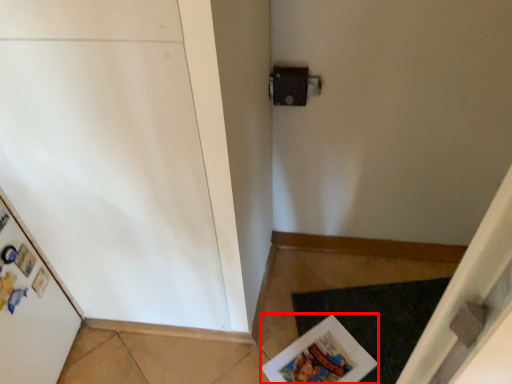
Question: In this image, where is magazine (annotated by the red box) located relative to doormat?

Choices:
 (A) right
 (B) left

Answer: (B)